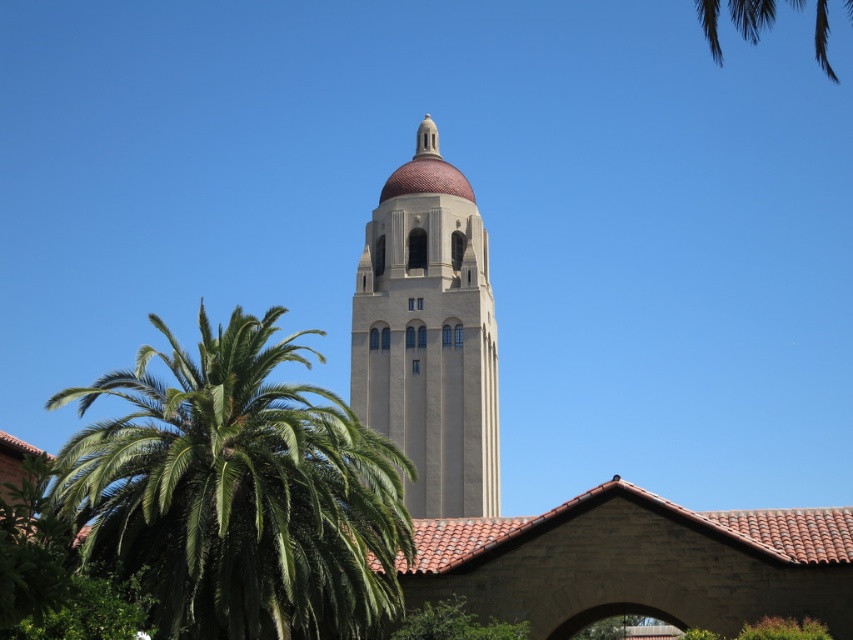
Question: Is beige stone bell tower at center positioned behind green leafy palm tree at upper right?

Choices:
 (A) no
 (B) yes

Answer: (B)

Question: Which point is farther to the camera?

Choices:
 (A) (x=836, y=83)
 (B) (x=393, y=630)
 (C) (x=341, y=493)

Answer: (A)

Question: Does beige stone bell tower at center have a smaller size compared to green leafy palm tree at upper right?

Choices:
 (A) no
 (B) yes

Answer: (B)

Question: Which is nearer to the green leafy palm tree at upper right?

Choices:
 (A) green leafy palm at left
 (B) green leafy tree at lower center
 (C) beige stone bell tower at center

Answer: (C)

Question: Among these objects, which one is farthest from the camera?

Choices:
 (A) green leafy tree at lower center
 (B) green leafy palm at left
 (C) beige stone bell tower at center
 (D) green leafy palm tree at upper right

Answer: (C)

Question: Is green leafy palm at left further to camera compared to green leafy palm tree at upper right?

Choices:
 (A) no
 (B) yes

Answer: (A)